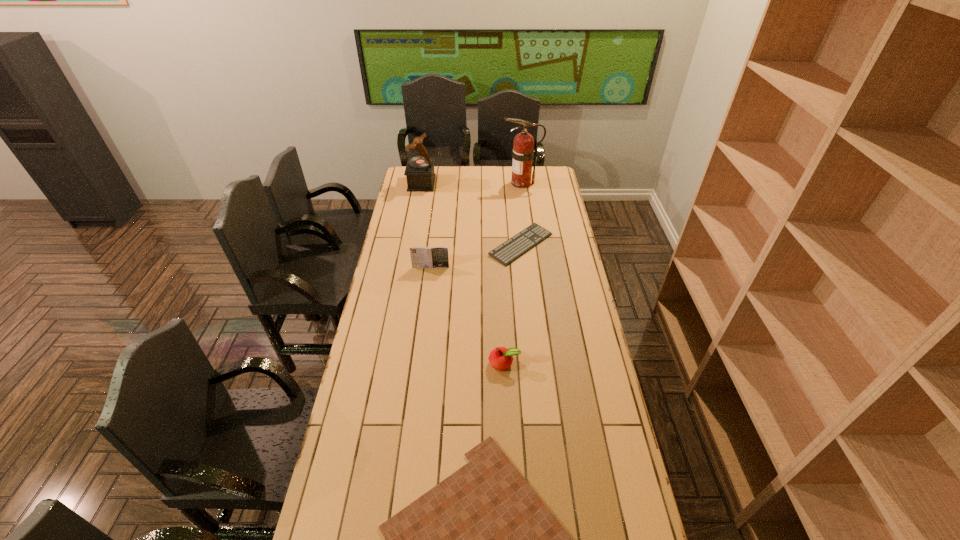
The height and width of the screenshot is (540, 960). Identify the location of object at the far right corner. (523, 152).

This screenshot has height=540, width=960. In order to click on free space at the far edge of the desktop in this screenshot , I will do `click(498, 179)`.

In the image, there is a desktop. Identify the location of free space at the left edge. (406, 264).

You are a GUI agent. You are given a task and a screenshot of the screen. Output one action in this format:
    pyautogui.click(x=<x>, y=<y>)
    Task: Click on the free space at the right edge of the desktop
    
    Given the screenshot: What is the action you would take?
    pyautogui.click(x=588, y=435)

Where is `blank region between the second nearest object and the fourth shortest object`? This screenshot has height=540, width=960. blank region between the second nearest object and the fourth shortest object is located at coordinates (468, 315).

At what (x,y) coordinates should I click in order to perform the action: click on free space between the fifth tallest object and the phonograph_record. Please return your answer as a coordinate pair (x, y). This screenshot has height=540, width=960. Looking at the image, I should click on (471, 214).

Locate an element on the screen. free space between the fire extinguisher and the fifth shortest object is located at coordinates (471, 183).

Locate an element on the screen. free space that is in between the apple and the third tallest object is located at coordinates (468, 315).

I want to click on free space between the computer keyboard and the fire extinguisher, so click(x=521, y=214).

The height and width of the screenshot is (540, 960). Find the location of `vacant area between the fire extinguisher and the book`. vacant area between the fire extinguisher and the book is located at coordinates (476, 225).